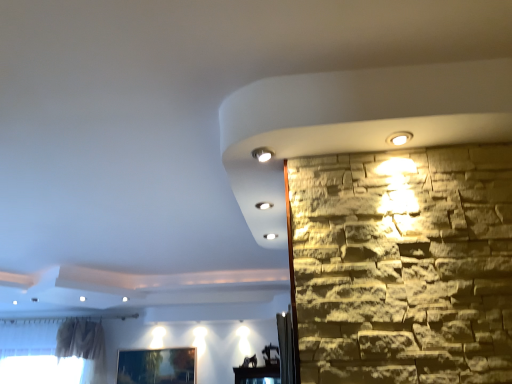
Question: Visually, is matte white spotlight at upper center positioned to the left or to the right of metallic silver picture frame at lower left?

Choices:
 (A) right
 (B) left

Answer: (A)

Question: From their relative heights in the image, would you say matte white spotlight at upper center is taller or shorter than metallic silver picture frame at lower left?

Choices:
 (A) tall
 (B) short

Answer: (B)

Question: From the image's perspective, relative to metallic silver picture frame at lower left, is matte white spotlight at upper center above or below?

Choices:
 (A) above
 (B) below

Answer: (A)

Question: From their relative heights in the image, would you say metallic silver picture frame at lower left is taller or shorter than matte white spotlight at upper center?

Choices:
 (A) short
 (B) tall

Answer: (B)

Question: Based on their sizes in the image, would you say metallic silver picture frame at lower left is bigger or smaller than matte white spotlight at upper center?

Choices:
 (A) big
 (B) small

Answer: (A)

Question: From a real-world perspective, relative to matte white spotlight at upper center, is metallic silver picture frame at lower left vertically above or below?

Choices:
 (A) above
 (B) below

Answer: (B)

Question: Relative to matte white spotlight at upper center, is metallic silver picture frame at lower left in front or behind?

Choices:
 (A) front
 (B) behind

Answer: (B)